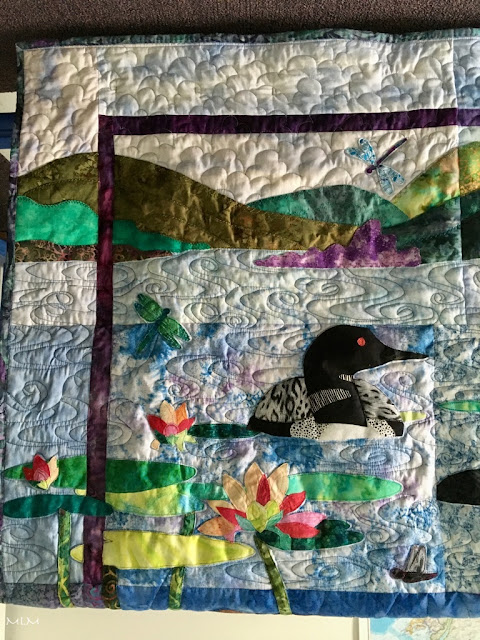
At what (x,y) coordinates should I click in order to perform the action: click on light green lily pad design on quilt. Please return your answer as a coordinate pair (x, y). The height and width of the screenshot is (640, 480). Looking at the image, I should click on (338, 486), (304, 482).